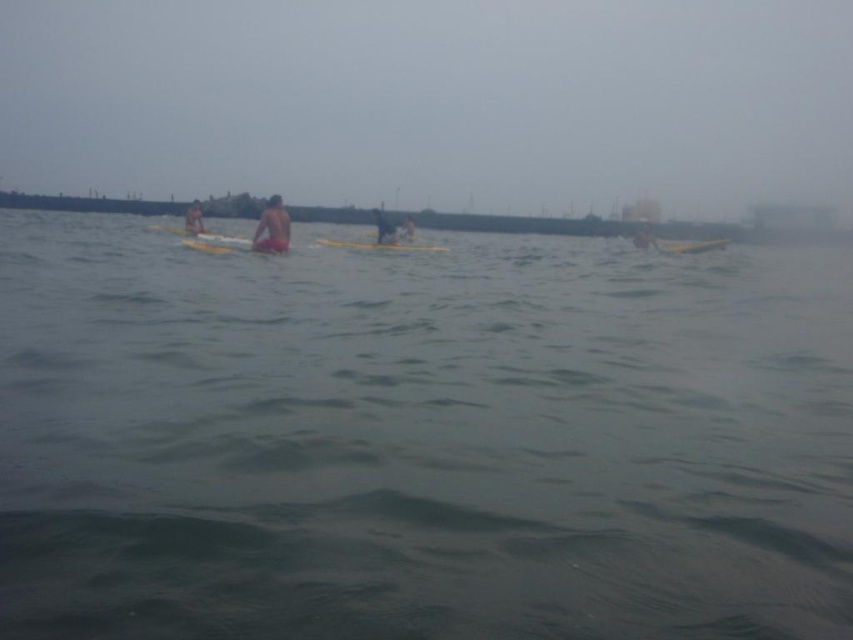
Does orange fabric person at center lie behind smooth yellow surfboard at center?

No, orange fabric person at center is closer to the viewer.

Does point (286, 216) lie behind point (410, 230)?

No.

Which is behind, point (276, 204) or point (401, 234)?

The point (401, 234) is behind.

You are a GUI agent. You are given a task and a screenshot of the screen. Output one action in this format:
    pyautogui.click(x=<x>, y=<y>)
    Task: Click on the orange fabric person at center
    
    Given the screenshot: What is the action you would take?
    pyautogui.click(x=271, y=227)

Between point (381, 248) and point (405, 228), which one is positioned behind?

The point (405, 228) is more distant.

Which of these two, yellow foam at center or smooth yellow surfboard at center, stands taller?

smooth yellow surfboard at center is taller.

The width and height of the screenshot is (853, 640). In order to click on yellow foam at center in this screenshot , I will do `click(380, 244)`.

Is green water at center shorter than orange fabric person at center?

In fact, green water at center may be taller than orange fabric person at center.

Between green water at center and orange fabric person at center, which one has more height?

Standing taller between the two is green water at center.

What are the coordinates of `green water at center` in the screenshot? It's located at (421, 440).